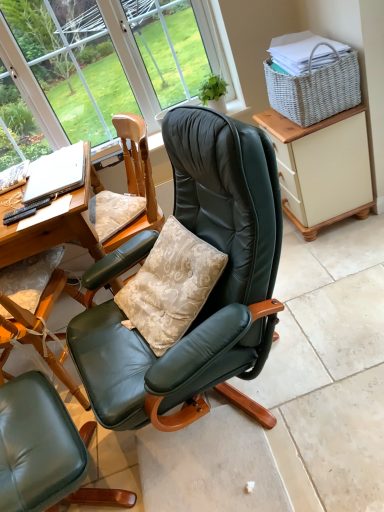
This screenshot has width=384, height=512. I want to click on blank space above silver metallic laptop at left (from a real-world perspective), so click(47, 167).